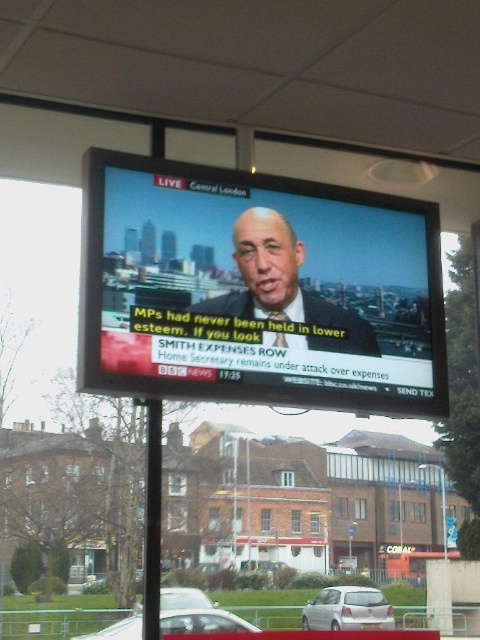
Question: Does matte black suit at center have a larger size compared to silver metallic car at center?

Choices:
 (A) no
 (B) yes

Answer: (A)

Question: Which is nearer to the silver metallic hatchback at lower center?

Choices:
 (A) matte black screen at center
 (B) silver metallic car at center
 (C) matte black suit at center
 (D) white matte car at lower center

Answer: (D)

Question: Estimate the real-world distances between objects in this image. Which object is farther from the silver metallic car at center?

Choices:
 (A) white matte car at lower center
 (B) matte black suit at center

Answer: (B)

Question: Can you confirm if matte black screen at center is smaller than white matte car at lower center?

Choices:
 (A) yes
 (B) no

Answer: (A)

Question: Does matte black screen at center lie behind silver metallic car at center?

Choices:
 (A) no
 (B) yes

Answer: (A)

Question: Which point appears closest to the camera in this image?

Choices:
 (A) (321, 627)
 (B) (171, 588)

Answer: (A)